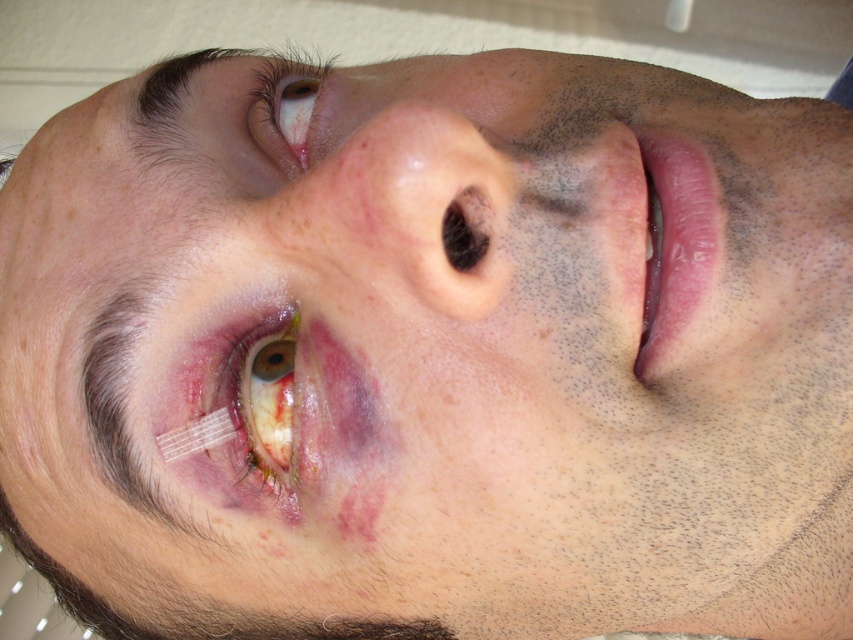
You are a photographer trying to capture a close portrait of the person. The camera is currently positioned 15.12 inches away from the pink smooth lips at center. To ensure the subject is in focus, you need to maintain a minimum distance of 18 inches. Should you move the camera closer or farther away?

The camera is currently 15.12 inches away from the pink smooth lips at center, which is less than the required 18 inches. To meet the focus requirement, you should move the camera farther away from the pink smooth lips at center.

Based on the scene description, where are the pink smooth lips at center located in terms of coordinates?

The pink smooth lips at center are located at coordinates point [675,248].